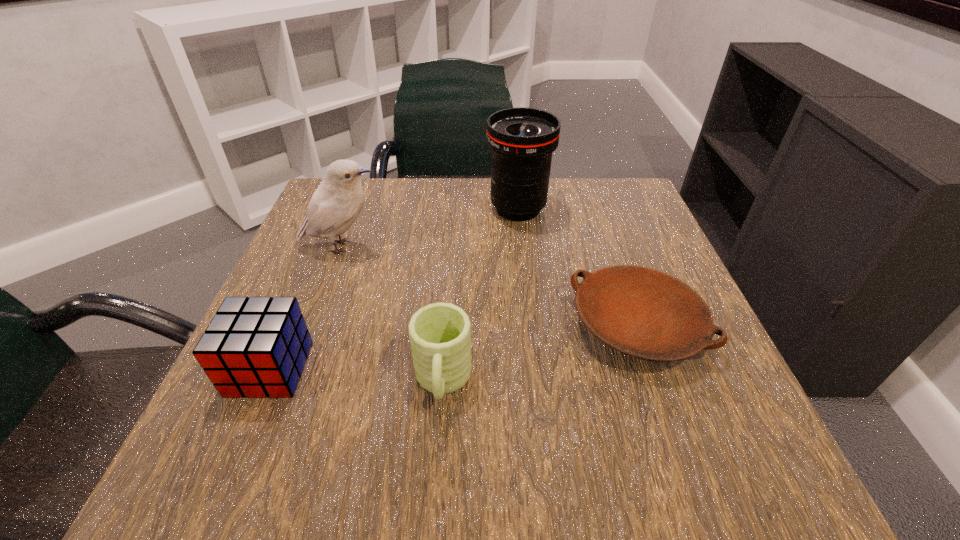
Choose which object is the fourth nearest neighbor to the bird. Please provide its 2D coordinates. Your answer should be formatted as a tuple, i.e. [(x, y)], where the tuple contains the x and y coordinates of a point satisfying the conditions above.

[(644, 313)]

Locate an element on the screen. free spot that satisfies the following two spatial constraints: 1. at the beak of the bird; 2. on the back side of the plate is located at coordinates 313,326.